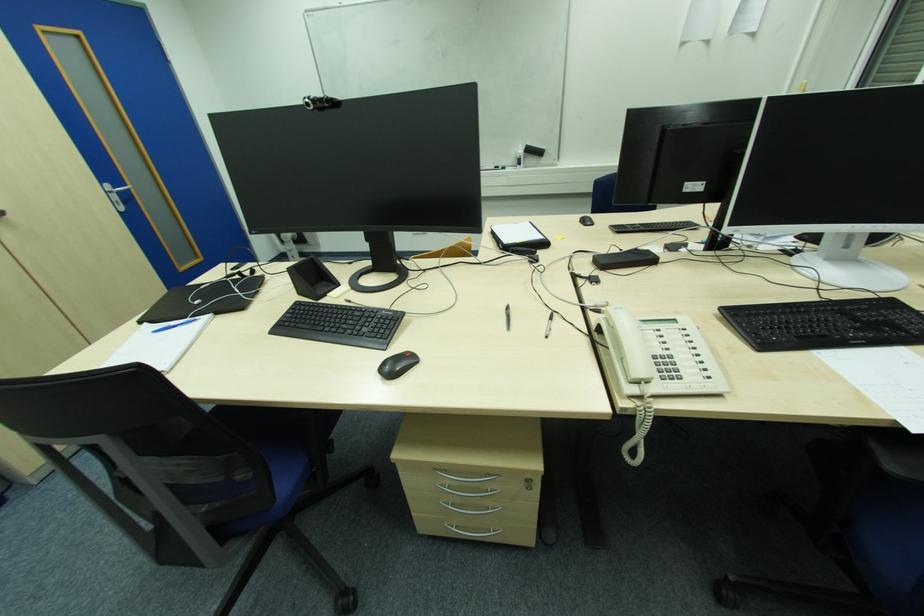
At what (x,y) coordinates should I click in order to perform the action: click on chair sitting surface. Please return your answer as a coordinate pair (x, y). The width and height of the screenshot is (924, 616). Looking at the image, I should click on (282, 424).